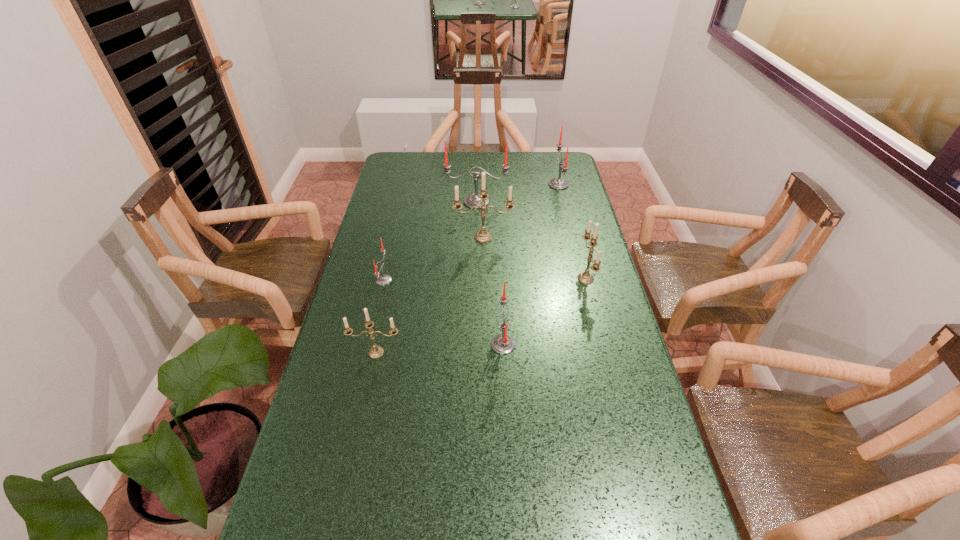
The width and height of the screenshot is (960, 540). Find the location of `the smallest red candle`. the smallest red candle is located at coordinates pyautogui.click(x=383, y=279).

In order to click on free space located on the front-facing side of the biggest red candle in this screenshot , I will do `click(476, 240)`.

At what (x,y) coordinates should I click in order to perform the action: click on vacant space located on the back of the third farthest object. Please return your answer as a coordinate pair (x, y). This screenshot has width=960, height=540. Looking at the image, I should click on (483, 201).

Image resolution: width=960 pixels, height=540 pixels. I want to click on vacant space located 0.210m on the front-facing side of the third smallest red candle, so point(499,185).

Locate an element on the screen. This screenshot has width=960, height=540. vacant space located on the front-facing side of the third smallest red candle is located at coordinates (x=458, y=185).

Identify the location of vacant space located on the front-facing side of the third smallest red candle. (491, 185).

Locate an element on the screen. This screenshot has height=540, width=960. vacant space located on the front of the rightmost metallic candle is located at coordinates (607, 363).

The image size is (960, 540). Identify the location of free region located on the front-facing side of the third biggest red candle. (407, 345).

What are the coordinates of `free space located on the front-facing side of the third biggest red candle` in the screenshot? It's located at (431, 345).

You are a GUI agent. You are given a task and a screenshot of the screen. Output one action in this format:
    pyautogui.click(x=<x>, y=<y>)
    Task: Click on the vacant space located 0.380m on the front-facing side of the third biggest red candle
    The height and width of the screenshot is (540, 960).
    Given the screenshot: What is the action you would take?
    pyautogui.click(x=358, y=345)